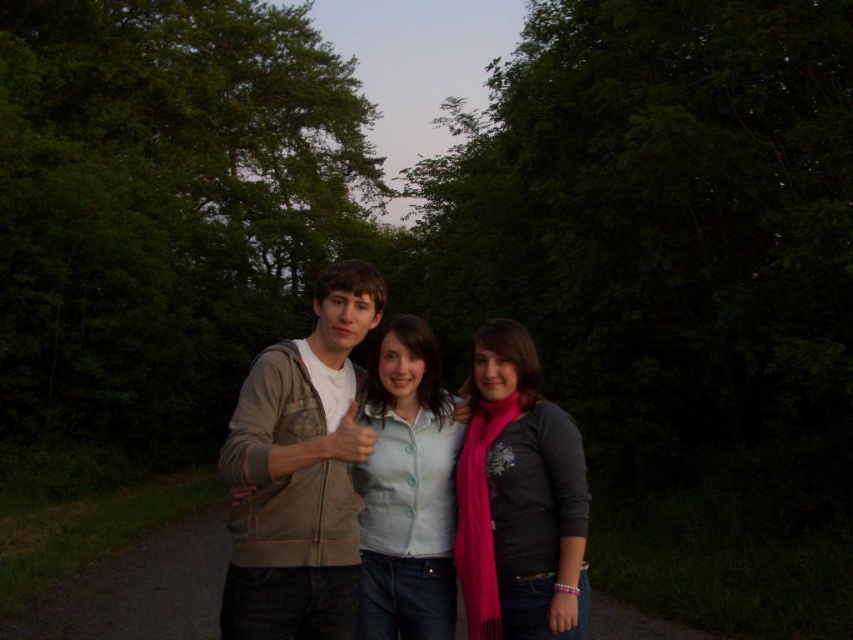
Question: Is khaki cotton hoodie at center below light blue button-up shirt at center?

Choices:
 (A) yes
 (B) no

Answer: (B)

Question: Which of these objects is positioned closest to the matte beige hoodie at center?

Choices:
 (A) matte pink scarf at center
 (B) khaki cotton hoodie at center

Answer: (B)

Question: Where is khaki cotton hoodie at center located in relation to matte pink scarf at center in the image?

Choices:
 (A) right
 (B) left

Answer: (B)

Question: Which point appears farthest from the camera in this image?

Choices:
 (A) (309, 355)
 (B) (508, 428)
 (C) (225, 572)
 (D) (410, 536)

Answer: (C)

Question: Which point is farther to the camera?

Choices:
 (A) (248, 467)
 (B) (372, 461)
 (C) (297, 445)
 (D) (503, 609)

Answer: (B)

Question: Is khaki cotton hoodie at center wider than matte pink scarf at center?

Choices:
 (A) no
 (B) yes

Answer: (B)